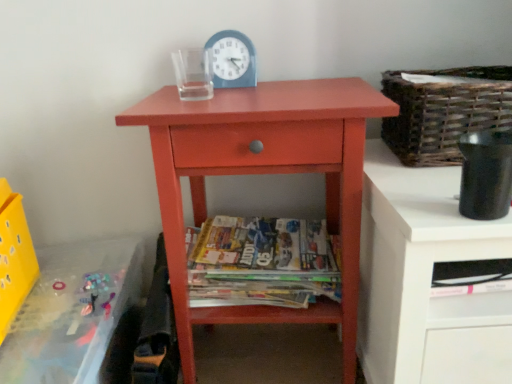
Identify the location of yellow plastic crate at lower left. click(x=14, y=257).

The height and width of the screenshot is (384, 512). I want to click on blue plastic clock at upper center, so click(x=232, y=59).

Considering the relative sizes of woven brown basket at upper right and yellow plastic crate at lower left in the image provided, is woven brown basket at upper right shorter than yellow plastic crate at lower left?

Correct, woven brown basket at upper right is not as tall as yellow plastic crate at lower left.

Considering the sizes of woven brown basket at upper right and yellow plastic crate at lower left in the image, is woven brown basket at upper right wider or thinner than yellow plastic crate at lower left?

Considering their sizes, woven brown basket at upper right looks broader than yellow plastic crate at lower left.

Is woven brown basket at upper right inside the boundaries of yellow plastic crate at lower left, or outside?

woven brown basket at upper right is spatially situated outside yellow plastic crate at lower left.

Considering the points (370, 109) and (330, 290), which point is behind, point (370, 109) or point (330, 290)?

The point (330, 290) is behind.

Considering the relative sizes of matte wood nightstand at center and printed paper magazines at center in the image provided, is matte wood nightstand at center shorter than printed paper magazines at center?

Incorrect, the height of matte wood nightstand at center does not fall short of that of printed paper magazines at center.

In the scene shown: Could you tell me if matte wood nightstand at center is facing printed paper magazines at center?

Yes, matte wood nightstand at center is aimed at printed paper magazines at center.

Considering the sizes of objects matte wood nightstand at center and printed paper magazines at center in the image provided, who is wider, matte wood nightstand at center or printed paper magazines at center?

matte wood nightstand at center.

Is printed paper magazines at center shorter than yellow plastic crate at lower left?

Yes.

Is printed paper magazines at center not within yellow plastic crate at lower left?

Indeed, printed paper magazines at center is completely outside yellow plastic crate at lower left.

Does printed paper magazines at center appear on the right side of yellow plastic crate at lower left?

Yes, printed paper magazines at center is to the right of yellow plastic crate at lower left.

Looking at this image, considering the relative positions of printed paper magazines at center and yellow plastic crate at lower left in the image provided, is printed paper magazines at center behind yellow plastic crate at lower left?

Yes, printed paper magazines at center is further from the viewer.

Considering the points (415, 116) and (48, 262), which point is behind, point (415, 116) or point (48, 262)?

Point (48, 262)

Looking at this image, does woven brown basket at upper right come behind translucent plastic changing table at lower left?

Yes, woven brown basket at upper right is behind translucent plastic changing table at lower left.

Is woven brown basket at upper right looking in the opposite direction of translucent plastic changing table at lower left?

woven brown basket at upper right does not have its back to translucent plastic changing table at lower left.

Is point (218, 86) closer or farther from the camera than point (6, 201)?

Point (218, 86) appears to be closer to the viewer than point (6, 201).

Is blue plastic clock at upper center spatially inside yellow plastic crate at lower left, or outside of it?

blue plastic clock at upper center is outside yellow plastic crate at lower left.

Who is bigger, blue plastic clock at upper center or yellow plastic crate at lower left?

yellow plastic crate at lower left.

Is blue plastic clock at upper center to the left of yellow plastic crate at lower left from the viewer's perspective?

No.

The height and width of the screenshot is (384, 512). In order to click on crate on the left of translucent plastic changing table at lower left in this screenshot , I will do `click(14, 257)`.

Is translucent plastic changing table at lower left oriented towards yellow plastic crate at lower left?

No, translucent plastic changing table at lower left is not aimed at yellow plastic crate at lower left.

Is translucent plastic changing table at lower left taller or shorter than yellow plastic crate at lower left?

In the image, translucent plastic changing table at lower left appears to be taller than yellow plastic crate at lower left.

Can you confirm if translucent plastic changing table at lower left is wider than yellow plastic crate at lower left?

Yes, translucent plastic changing table at lower left is wider than yellow plastic crate at lower left.

Which is in front, printed paper magazines at center or translucent plastic changing table at lower left?

translucent plastic changing table at lower left is in front.

From the image's perspective, is printed paper magazines at center positioned above or below translucent plastic changing table at lower left?

printed paper magazines at center is above translucent plastic changing table at lower left.

Considering the relative sizes of printed paper magazines at center and translucent plastic changing table at lower left in the image provided, is printed paper magazines at center shorter than translucent plastic changing table at lower left?

Yes.

You are a GUI agent. You are given a task and a screenshot of the screen. Output one action in this format:
    pyautogui.click(x=<x>, y=<y>)
    Task: Click on the crate below the woven brown basket at upper right (from the image's perspective)
    Image resolution: width=512 pixels, height=384 pixels.
    Given the screenshot: What is the action you would take?
    pyautogui.click(x=14, y=257)

I want to click on nightstand above the printed paper magazines at center (from the image's perspective), so click(263, 173).

Estimate the real-world distances between objects in this image. Which object is closer to printed paper magazines at center, blue plastic clock at upper center or translucent plastic changing table at lower left?

translucent plastic changing table at lower left lies closer to printed paper magazines at center than the other object.

Estimate the real-world distances between objects in this image. Which object is further from blue plastic clock at upper center, yellow plastic crate at lower left or printed paper magazines at center?

yellow plastic crate at lower left is positioned further to the anchor blue plastic clock at upper center.

Which object lies nearer to the anchor point blue plastic clock at upper center, translucent plastic changing table at lower left or yellow plastic crate at lower left?

translucent plastic changing table at lower left lies closer to blue plastic clock at upper center than the other object.

From the image, which object appears to be nearer to matte wood nightstand at center, blue plastic clock at upper center or translucent plastic changing table at lower left?

blue plastic clock at upper center is closer to matte wood nightstand at center.

Estimate the real-world distances between objects in this image. Which object is further from translucent plastic changing table at lower left, matte wood nightstand at center or yellow plastic crate at lower left?

Among the two, matte wood nightstand at center is located further to translucent plastic changing table at lower left.

Which object lies nearer to the anchor point printed paper magazines at center, woven brown basket at upper right or translucent plastic changing table at lower left?

translucent plastic changing table at lower left is closer to printed paper magazines at center.

Estimate the real-world distances between objects in this image. Which object is further from blue plastic clock at upper center, translucent plastic changing table at lower left or printed paper magazines at center?

translucent plastic changing table at lower left lies further to blue plastic clock at upper center than the other object.

Which object lies further to the anchor point printed paper magazines at center, woven brown basket at upper right or matte wood nightstand at center?

Among the two, woven brown basket at upper right is located further to printed paper magazines at center.

Identify the location of nightstand between printed paper magazines at center and woven brown basket at upper right in the horizontal direction. Image resolution: width=512 pixels, height=384 pixels. (263, 173).

Where is `clock between yellow plastic crate at lower left and matte wood nightstand at center from left to right`? clock between yellow plastic crate at lower left and matte wood nightstand at center from left to right is located at coordinates (232, 59).

Find the location of a particular element. magazine between yellow plastic crate at lower left and matte wood nightstand at center from left to right is located at coordinates (261, 263).

I want to click on magazine located between blue plastic clock at upper center and woven brown basket at upper right in the left-right direction, so click(x=261, y=263).